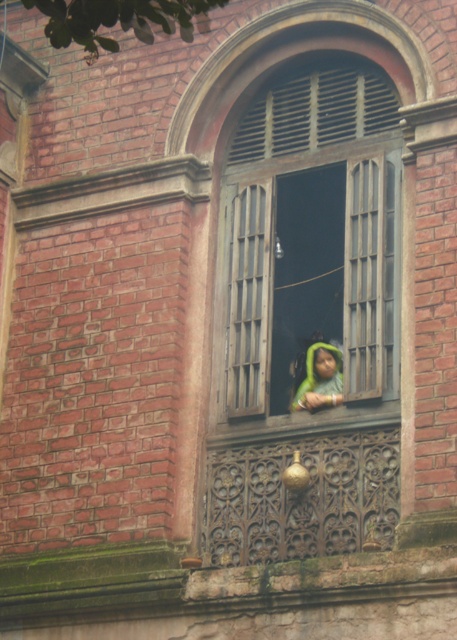
You are an architect inspecting a historic building. You notice the wooden window at center and the green fabric at center. Which object is closer to you from your current viewpoint?

The wooden window at center is closer to you than the green fabric at center because it is in front of it.

You are an interior designer assessing the space inside the arched window. You need to place a decorative item that requires a surface area equal to the wooden window at center. Can the green fabric at center accommodate it?

The wooden window at center is wider than the green fabric at center. Since the decorative item requires a surface area equal to the wooden window at center, the green fabric at center is not large enough to accommodate it.

You are standing in front of the building with the arched window. You notice two points marked on the wall. The first point is at coordinate (393,129) and the second is at (317,364). Which point is closer to you?

Point (317,364) is closer to you because it is in front of point (393,129).